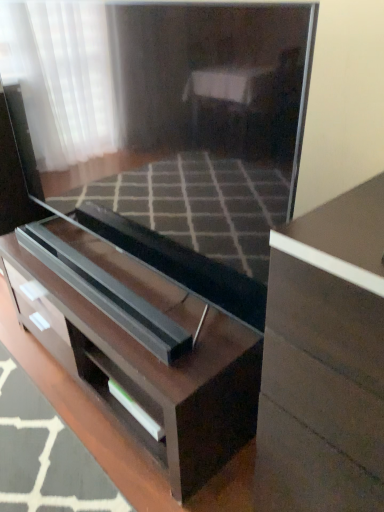
Question: Is matte brown chest of drawers at right, which is the 2th chest of drawers in left-to-right order, closer to the viewer compared to dark wood chest of drawers at center, which is the 2th chest of drawers in right-to-left order?

Choices:
 (A) no
 (B) yes

Answer: (B)

Question: Does matte brown chest of drawers at right, which is the 2th chest of drawers in left-to-right order, contain dark wood chest of drawers at center, which is the 2th chest of drawers in right-to-left order?

Choices:
 (A) no
 (B) yes

Answer: (A)

Question: Is matte brown chest of drawers at right, which is the 2th chest of drawers in left-to-right order, smaller than dark wood chest of drawers at center, which is the 2th chest of drawers in right-to-left order?

Choices:
 (A) yes
 (B) no

Answer: (A)

Question: Does matte brown chest of drawers at right, the first chest of drawers viewed from the right, have a larger size compared to dark wood chest of drawers at center, the first chest of drawers from the left?

Choices:
 (A) no
 (B) yes

Answer: (A)

Question: Considering the relative positions of matte brown chest of drawers at right, which is the 2th chest of drawers in left-to-right order, and dark wood chest of drawers at center, the first chest of drawers from the left, in the image provided, is matte brown chest of drawers at right, which is the 2th chest of drawers in left-to-right order, to the right of dark wood chest of drawers at center, the first chest of drawers from the left, from the viewer's perspective?

Choices:
 (A) yes
 (B) no

Answer: (A)

Question: Does matte brown chest of drawers at right, the first chest of drawers viewed from the right, have a lesser width compared to dark wood chest of drawers at center, the first chest of drawers from the left?

Choices:
 (A) no
 (B) yes

Answer: (B)

Question: From a real-world perspective, is dark wood chest of drawers at center, the first chest of drawers from the left, positioned over matte brown chest of drawers at right, the first chest of drawers viewed from the right, based on gravity?

Choices:
 (A) yes
 (B) no

Answer: (B)

Question: Does dark wood chest of drawers at center, the first chest of drawers from the left, come in front of matte brown chest of drawers at right, which is the 2th chest of drawers in left-to-right order?

Choices:
 (A) no
 (B) yes

Answer: (A)

Question: Is dark wood chest of drawers at center, which is the 2th chest of drawers in right-to-left order, completely or partially outside of matte brown chest of drawers at right, the first chest of drawers viewed from the right?

Choices:
 (A) no
 (B) yes

Answer: (B)

Question: Considering the relative sizes of dark wood chest of drawers at center, which is the 2th chest of drawers in right-to-left order, and matte brown chest of drawers at right, which is the 2th chest of drawers in left-to-right order, in the image provided, is dark wood chest of drawers at center, which is the 2th chest of drawers in right-to-left order, smaller than matte brown chest of drawers at right, which is the 2th chest of drawers in left-to-right order,?

Choices:
 (A) yes
 (B) no

Answer: (B)

Question: Can you confirm if dark wood chest of drawers at center, which is the 2th chest of drawers in right-to-left order, is thinner than matte brown chest of drawers at right, the first chest of drawers viewed from the right?

Choices:
 (A) yes
 (B) no

Answer: (B)

Question: Does dark wood chest of drawers at center, which is the 2th chest of drawers in right-to-left order, have a lesser height compared to matte brown chest of drawers at right, which is the 2th chest of drawers in left-to-right order?

Choices:
 (A) yes
 (B) no

Answer: (A)

Question: In terms of width, does matte brown chest of drawers at right, which is the 2th chest of drawers in left-to-right order, look wider or thinner when compared to dark wood chest of drawers at center, which is the 2th chest of drawers in right-to-left order?

Choices:
 (A) thin
 (B) wide

Answer: (A)